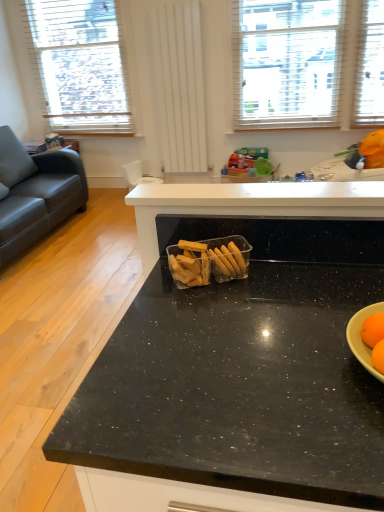
Describe the element at coordinates (208, 261) in the screenshot. This screenshot has width=384, height=512. I see `translucent plastic container of crackers at center` at that location.

At what (x,y) coordinates should I click in order to perform the action: click on white wooden blinds at upper left, which is the second window from right to left. Please return your answer as a coordinate pair (x, y). The image size is (384, 512). Looking at the image, I should click on (81, 65).

Identify the location of translucent plastic container of crackers at center. (208, 261).

Which is less distant, (x=123, y=98) or (x=221, y=252)?

The point (x=221, y=252) is more forward.

From a real-world perspective, is white wooden blinds at upper left, acting as the first window starting from the left, physically below translucent plastic container of crackers at center?

No.

How far apart are white wooden blinds at upper left, acting as the first window starting from the left, and translucent plastic container of crackers at center?

white wooden blinds at upper left, acting as the first window starting from the left, and translucent plastic container of crackers at center are 12.43 feet apart.

Is white wooden blinds at upper left, acting as the first window starting from the left, looking in the opposite direction of translucent plastic container of crackers at center?

No.

From a real-world perspective, is translucent plastic container of crackers at center on white textured window at upper center, the first window when ordered from right to left?

No, from a real-world perspective, translucent plastic container of crackers at center is not over white textured window at upper center, the first window when ordered from right to left

Is translucent plastic container of crackers at center closer to the viewer compared to white textured window at upper center, the first window when ordered from right to left?

Yes, the depth of translucent plastic container of crackers at center is less than that of white textured window at upper center, the first window when ordered from right to left.

Is white textured window at upper center, which is the 2th window in left-to-right order, at the back of translucent plastic container of crackers at center?

Correct, translucent plastic container of crackers at center is looking away from white textured window at upper center, which is the 2th window in left-to-right order.

Which point is more distant from viewer, (180, 262) or (285, 84)?

The point (285, 84) is farther.

Consider the image. Is white textured window at upper center, the first window when ordered from right to left, placed right next to translucent plastic container of crackers at center?

white textured window at upper center, the first window when ordered from right to left, is not next to translucent plastic container of crackers at center, and they're not touching.

From a real-world perspective, is white textured window at upper center, which is the 2th window in left-to-right order, positioned above or below translucent plastic container of crackers at center?

Clearly, from a real-world perspective, white textured window at upper center, which is the 2th window in left-to-right order, is above translucent plastic container of crackers at center.

Considering the sizes of objects white textured window at upper center, the first window when ordered from right to left, and translucent plastic container of crackers at center in the image provided, who is smaller, white textured window at upper center, the first window when ordered from right to left, or translucent plastic container of crackers at center?

With smaller size is translucent plastic container of crackers at center.

Relative to white wooden blinds at upper left, which is the second window from right to left, is white textured window at upper center, the first window when ordered from right to left, in front or behind?

Visually, white textured window at upper center, the first window when ordered from right to left, is located in front of white wooden blinds at upper left, which is the second window from right to left.

From the image's perspective, is white textured window at upper center, which is the 2th window in left-to-right order, located above or below white wooden blinds at upper left, which is the second window from right to left?

Clearly, from the image's perspective, white textured window at upper center, which is the 2th window in left-to-right order, is below white wooden blinds at upper left, which is the second window from right to left.

Considering the sizes of objects white textured window at upper center, the first window when ordered from right to left, and white wooden blinds at upper left, acting as the first window starting from the left, in the image provided, who is taller, white textured window at upper center, the first window when ordered from right to left, or white wooden blinds at upper left, acting as the first window starting from the left,?

With more height is white wooden blinds at upper left, acting as the first window starting from the left.

Identify the location of window located on the left of white textured window at upper center, the first window when ordered from right to left. This screenshot has height=512, width=384. (81, 65).

Based on the photo, in terms of size, does translucent plastic container of crackers at center appear bigger or smaller than white wooden blinds at upper left, acting as the first window starting from the left?

Considering their sizes, translucent plastic container of crackers at center takes up less space than white wooden blinds at upper left, acting as the first window starting from the left.

Which is correct: translucent plastic container of crackers at center is inside white wooden blinds at upper left, which is the second window from right to left, or outside of it?

translucent plastic container of crackers at center is spatially situated outside white wooden blinds at upper left, which is the second window from right to left.

This screenshot has height=512, width=384. What are the coordinates of `snack below the white wooden blinds at upper left, acting as the first window starting from the left (from the image's perspective)` in the screenshot? It's located at (208, 261).

Who is shorter, translucent plastic container of crackers at center or white wooden blinds at upper left, acting as the first window starting from the left?

translucent plastic container of crackers at center is shorter.

How much distance is there between white wooden blinds at upper left, acting as the first window starting from the left, and white textured window at upper center, which is the 2th window in left-to-right order?

1.58 meters.

Is white wooden blinds at upper left, acting as the first window starting from the left, not close to white textured window at upper center, the first window when ordered from right to left?

white wooden blinds at upper left, acting as the first window starting from the left, is positioned a significant distance from white textured window at upper center, the first window when ordered from right to left.

Is white wooden blinds at upper left, which is the second window from right to left, surrounding white textured window at upper center, the first window when ordered from right to left?

Actually, white textured window at upper center, the first window when ordered from right to left, is outside white wooden blinds at upper left, which is the second window from right to left.

Is white wooden blinds at upper left, acting as the first window starting from the left, positioned behind white textured window at upper center, the first window when ordered from right to left?

That is True.

Where is `snack that appears in front of the white wooden blinds at upper left, acting as the first window starting from the left`? The height and width of the screenshot is (512, 384). snack that appears in front of the white wooden blinds at upper left, acting as the first window starting from the left is located at coordinates (208, 261).

Locate an element on the screen. Image resolution: width=384 pixels, height=512 pixels. the 1st window behind the translucent plastic container of crackers at center, starting your count from the anchor is located at coordinates (308, 64).

From the image, which object appears to be farther from translucent plastic container of crackers at center, white wooden blinds at upper left, which is the second window from right to left, or white textured window at upper center, which is the 2th window in left-to-right order?

Among the two, white wooden blinds at upper left, which is the second window from right to left, is located further to translucent plastic container of crackers at center.

Considering their positions, is white wooden blinds at upper left, acting as the first window starting from the left, positioned further to white textured window at upper center, the first window when ordered from right to left, than translucent plastic container of crackers at center?

The object further to white textured window at upper center, the first window when ordered from right to left, is translucent plastic container of crackers at center.

When comparing their distances from white wooden blinds at upper left, which is the second window from right to left, does white textured window at upper center, which is the 2th window in left-to-right order, or translucent plastic container of crackers at center seem closer?

white textured window at upper center, which is the 2th window in left-to-right order, is positioned closer to the anchor white wooden blinds at upper left, which is the second window from right to left.

Considering their positions, is translucent plastic container of crackers at center positioned closer to white textured window at upper center, the first window when ordered from right to left, than white wooden blinds at upper left, acting as the first window starting from the left?

white wooden blinds at upper left, acting as the first window starting from the left, is closer to white textured window at upper center, the first window when ordered from right to left.

Estimate the real-world distances between objects in this image. Which object is closer to white wooden blinds at upper left, acting as the first window starting from the left, translucent plastic container of crackers at center or white textured window at upper center, which is the 2th window in left-to-right order?

white textured window at upper center, which is the 2th window in left-to-right order.

Which object lies further to the anchor point translucent plastic container of crackers at center, white textured window at upper center, which is the 2th window in left-to-right order, or white wooden blinds at upper left, which is the second window from right to left?

white wooden blinds at upper left, which is the second window from right to left.

The height and width of the screenshot is (512, 384). I want to click on window between translucent plastic container of crackers at center and white wooden blinds at upper left, acting as the first window starting from the left, from front to back, so click(308, 64).